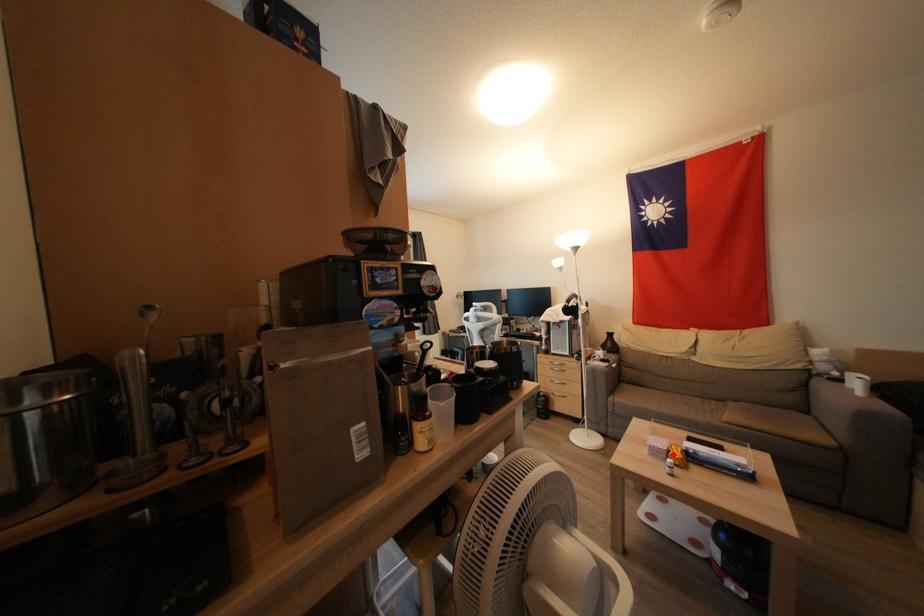
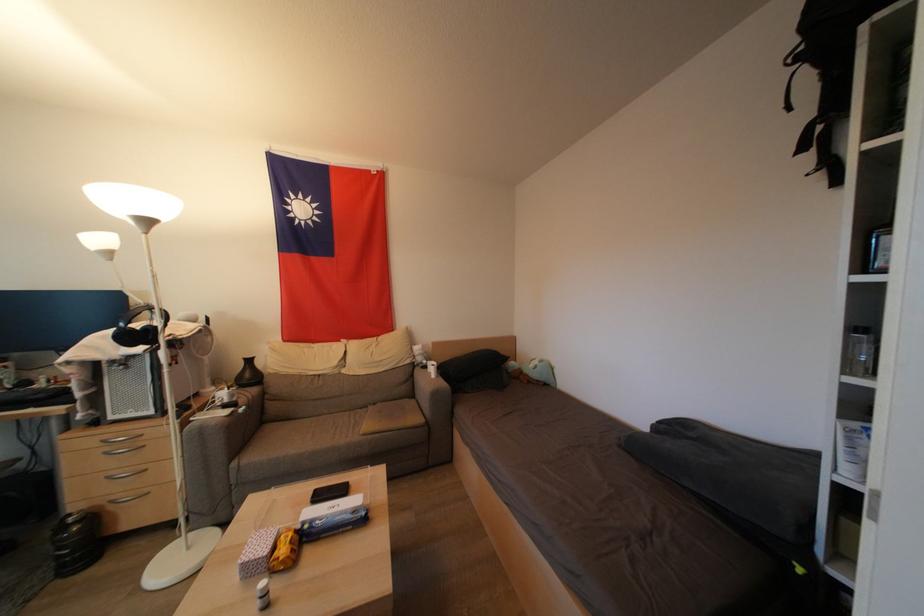
Find the pixel in the second image that matches the highlighted location in the first image.

(277, 553)